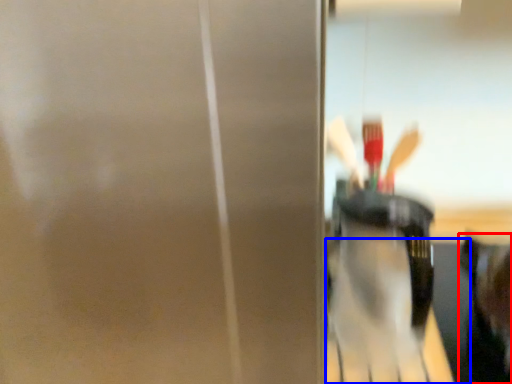
Question: Which of the following is the farthest to the observer, person (highlighted by a red box) or table (highlighted by a blue box)?

Choices:
 (A) person
 (B) table

Answer: (B)